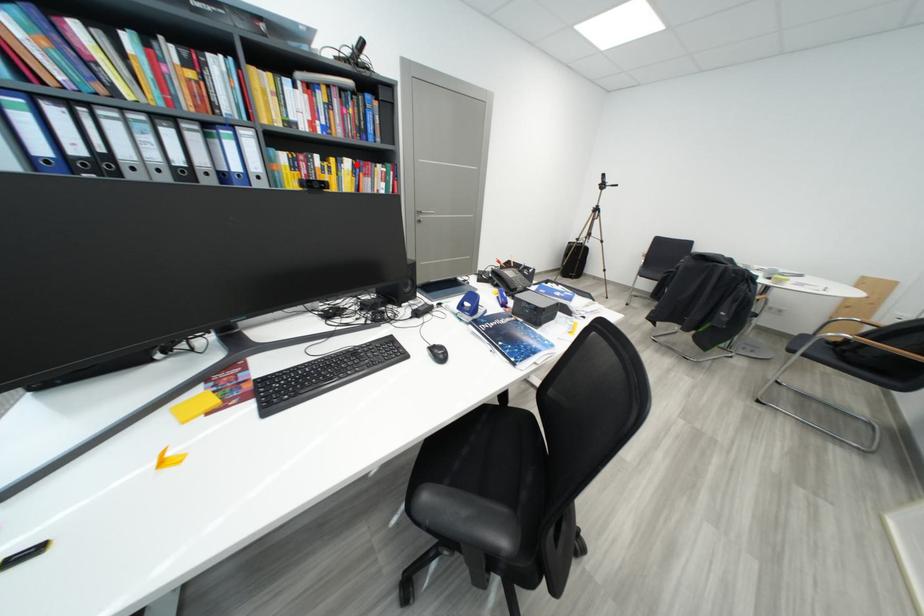
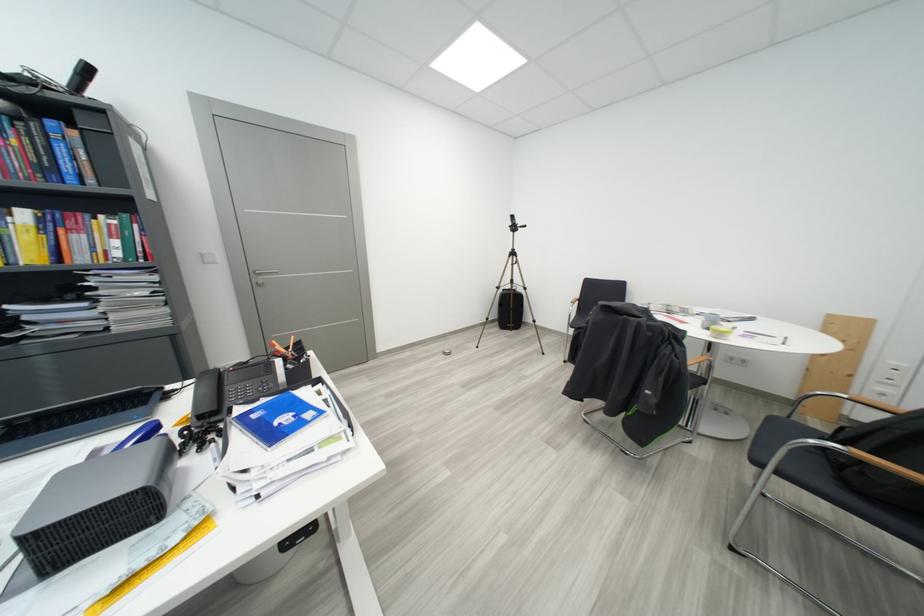
Where in the second image is the point corresponding to the highlighted location from the first image?

(32, 216)